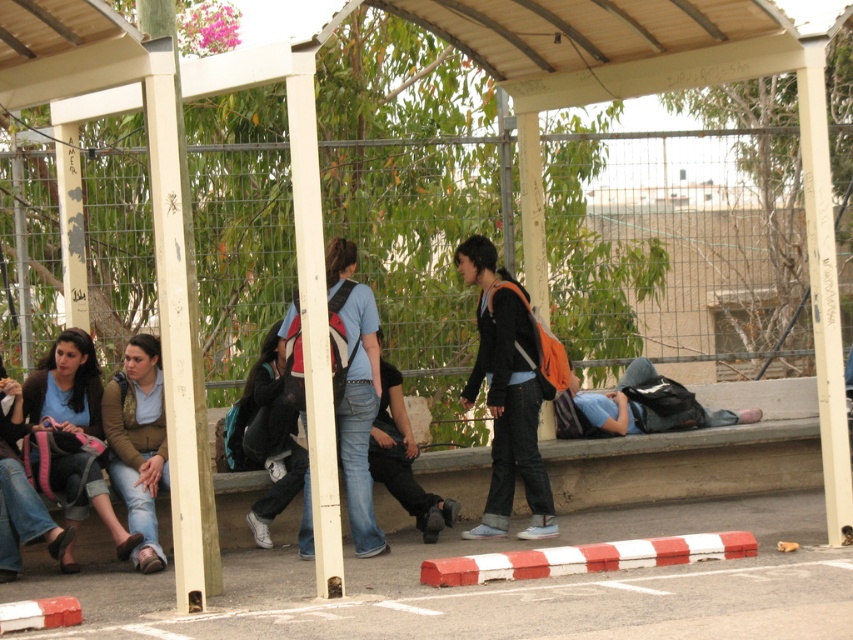
Question: Which object appears closest to the camera in this image?

Choices:
 (A) wire mesh fence at center
 (B) matte black backpack at center
 (C) matte black backpack at left

Answer: (C)

Question: Can you confirm if matte black backpack at center is smaller than blue denim jeans at lower right?

Choices:
 (A) no
 (B) yes

Answer: (B)

Question: Can you confirm if white/red striped barrier at lower center is positioned to the left of matte black jacket at center?

Choices:
 (A) no
 (B) yes

Answer: (B)

Question: Which of these objects is positioned farthest from the matte blue shirt at center?

Choices:
 (A) denim jacket at lower left
 (B) leather brown sandals at lower left
 (C) denim jeans at center

Answer: (A)

Question: Which of the following is the closest to the observer?

Choices:
 (A) white/red striped barrier at lower center
 (B) denim jacket at lower left
 (C) blue denim jeans at lower right
 (D) wire mesh fence at center

Answer: (A)

Question: From the image, what is the correct spatial relationship of matte blue shirt at center in relation to matte black backpack at center?

Choices:
 (A) above
 (B) below

Answer: (A)